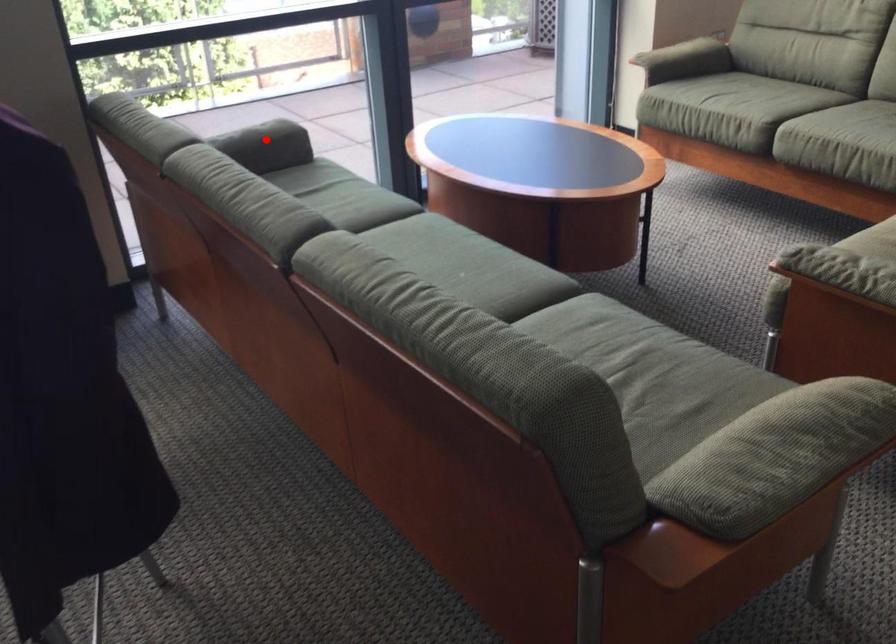
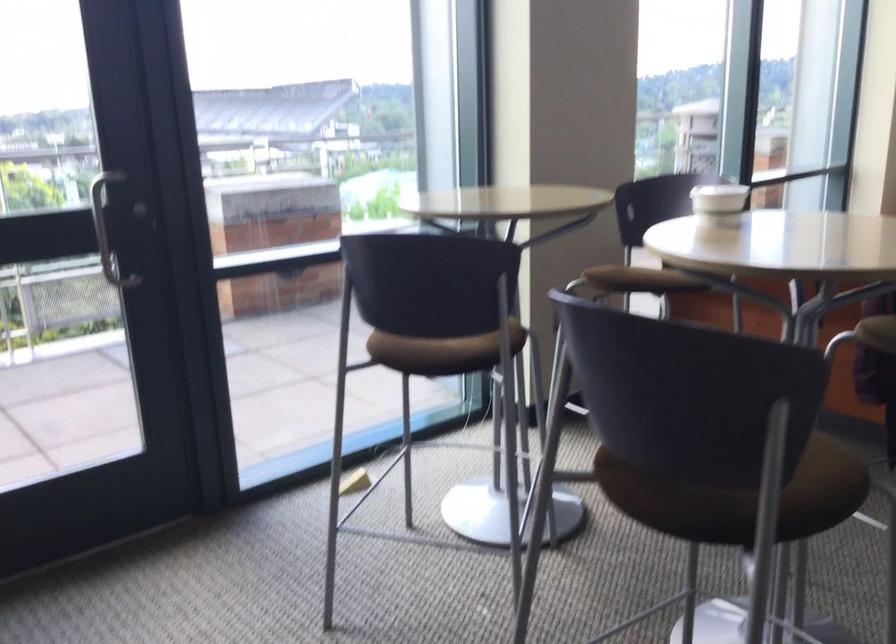
Question: I am providing you with two images of the same scene from different viewpoints. A red point is marked on the first image. Can you still see the location of the red point in image 2?

Choices:
 (A) Yes
 (B) No

Answer: (B)